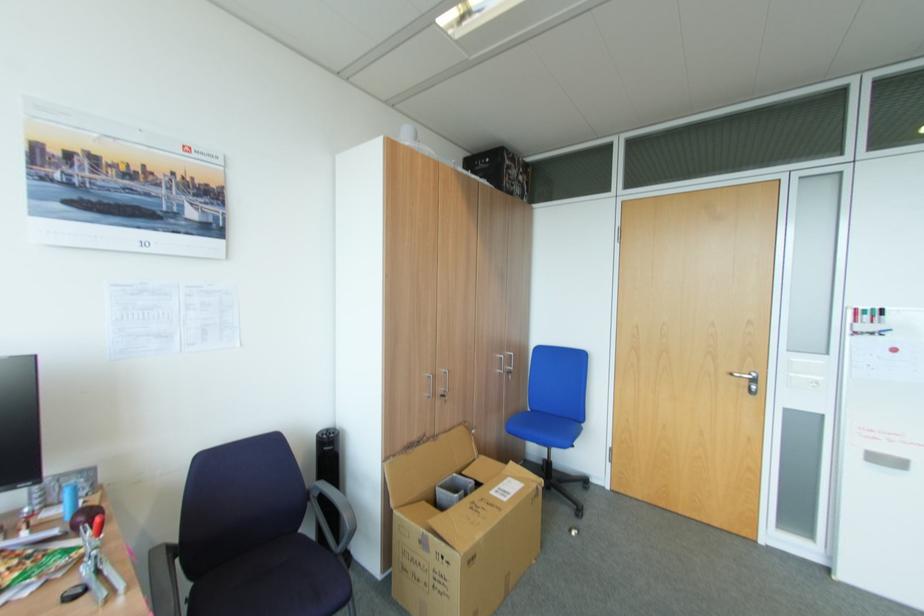
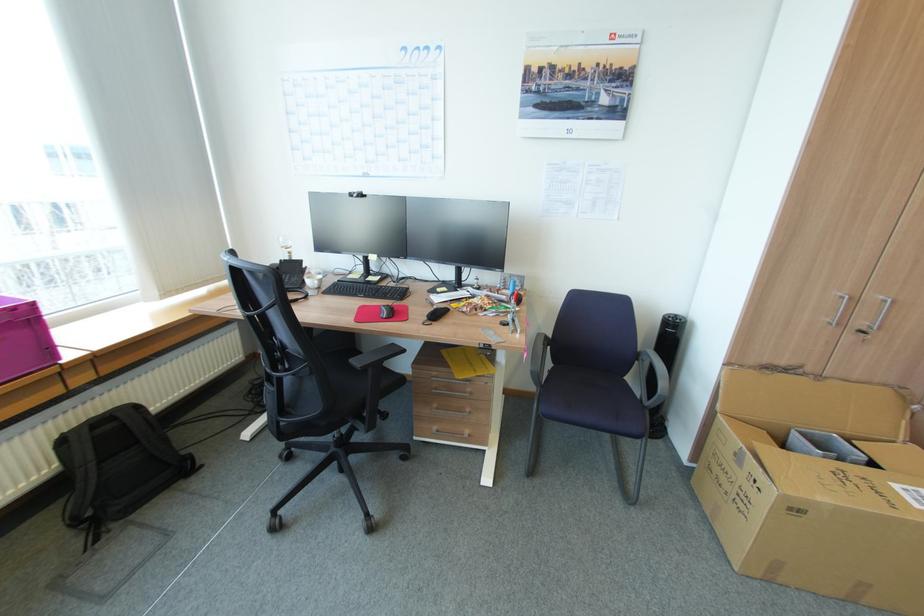
In the second image, find the point that corresponds to [198,588] in the first image.

(557, 368)